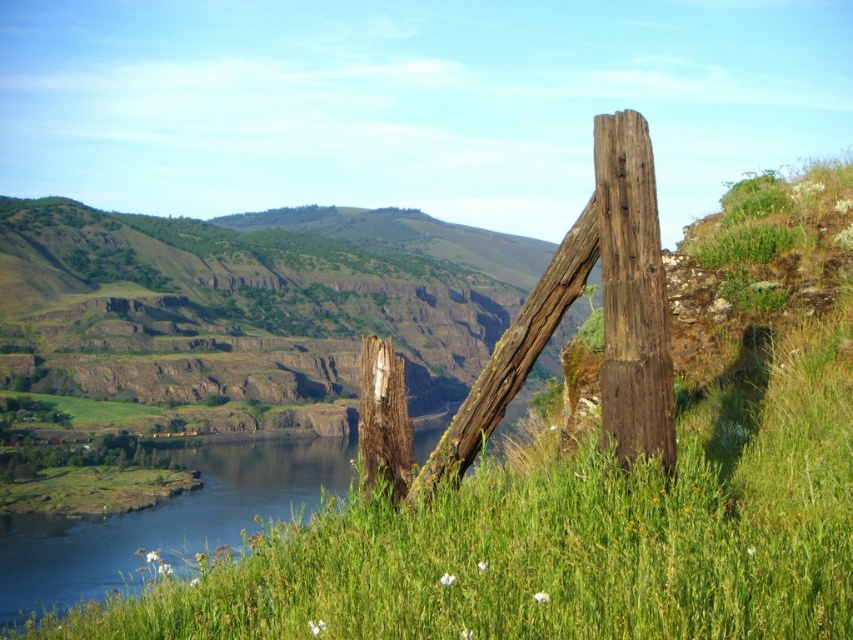
You are standing at the point with coordinates point (630, 349) and want to walk towards the river. Is the point point (144, 292) located between you and the river?

Point (144, 292) is behind point (630, 349), so it is not between you and the river. You can walk straight towards the river without encountering the point (144, 292) in your path.

In the scene shown: You are a hiker who wants to take a photo of the weathered brown wood post at right. You are currently standing on the green grassy hillside at left. Which direction should you move to get a better view of the post?

Since the green grassy hillside at left is taller than the weathered brown wood post at right, you should move down from the green grassy hillside at left to get a better view of the weathered brown wood post at right.

You are a hiker who wants to cross the river but needs to know which side has more space to set up camp. Based on the scene, which object is wider, the green grassy hillside at left or the weathered brown wood post at right?

The green grassy hillside at left is wider than the weathered brown wood post at right according to the description.